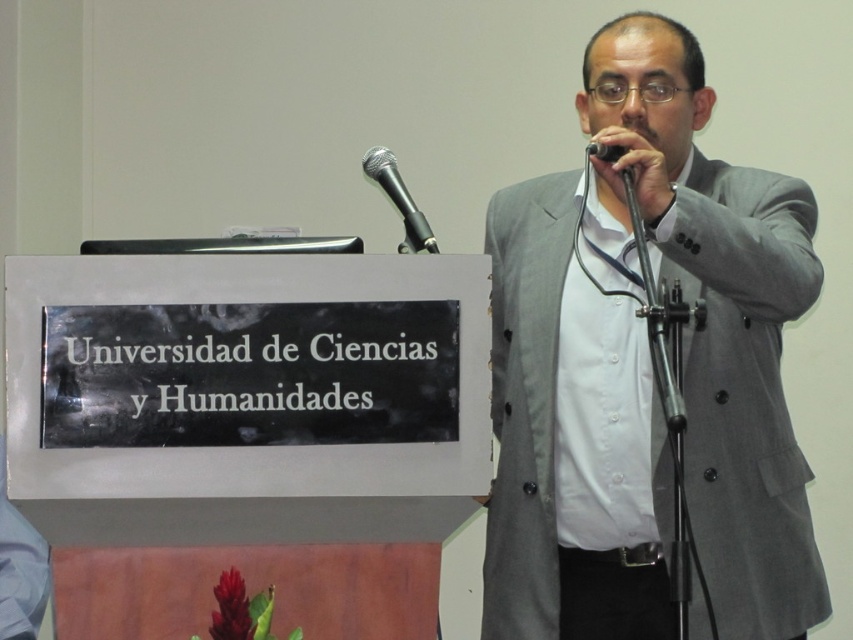
Consider the image. Does gray fabric suit at center have a greater width compared to black metallic microphone at upper center?

Indeed, gray fabric suit at center has a greater width compared to black metallic microphone at upper center.

Does gray fabric suit at center have a smaller size compared to black metallic microphone at upper center?

Incorrect, gray fabric suit at center is not smaller in size than black metallic microphone at upper center.

Is point (769, 531) less distant than point (397, 173)?

Yes, it is.

The image size is (853, 640). Find the location of `gray fabric suit at center`. gray fabric suit at center is located at coordinates (712, 314).